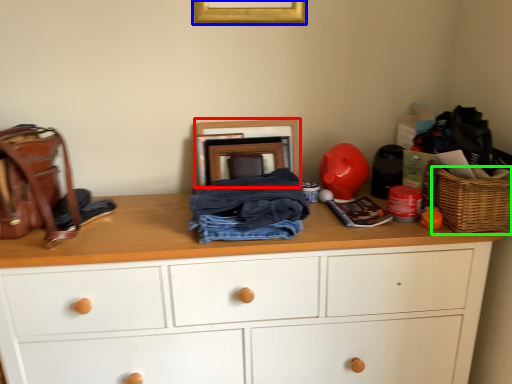
Question: Estimate the real-world distances between objects in this image. Which object is farther from picture frame (highlighted by a red box), picture frame (highlighted by a blue box) or picnic basket (highlighted by a green box)?

Choices:
 (A) picture frame
 (B) picnic basket

Answer: (B)